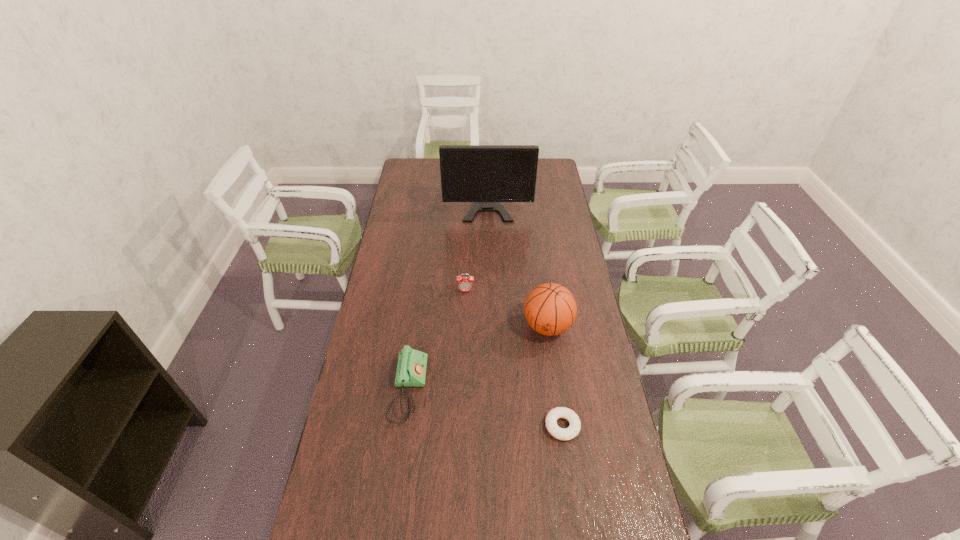
The height and width of the screenshot is (540, 960). In the image, there is a desktop. Identify the location of vacant space at the far left corner. (431, 161).

In order to click on free space at the far right corner of the desktop in this screenshot , I will do `click(543, 171)`.

Identify the location of vacant area that lies between the basketball and the farthest object. (517, 260).

This screenshot has height=540, width=960. I want to click on free spot between the second tallest object and the telephone, so click(x=478, y=358).

The image size is (960, 540). I want to click on vacant area between the doughnut and the third nearest object, so click(x=555, y=376).

The height and width of the screenshot is (540, 960). In order to click on vacant point located between the basketball and the farthest object in this screenshot , I will do `click(517, 260)`.

Locate an element on the screen. The width and height of the screenshot is (960, 540). empty location between the computer monitor and the third shortest object is located at coordinates (476, 242).

Where is `free spot between the third tallest object and the leftmost object`? This screenshot has width=960, height=540. free spot between the third tallest object and the leftmost object is located at coordinates (437, 340).

Where is `empty space that is in between the doughnut and the telephone`? The height and width of the screenshot is (540, 960). empty space that is in between the doughnut and the telephone is located at coordinates (486, 408).

You are a GUI agent. You are given a task and a screenshot of the screen. Output one action in this format:
    pyautogui.click(x=<x>, y=<y>)
    Task: Click on the free space between the alarm clock and the third nearest object
    
    Given the screenshot: What is the action you would take?
    pyautogui.click(x=507, y=309)